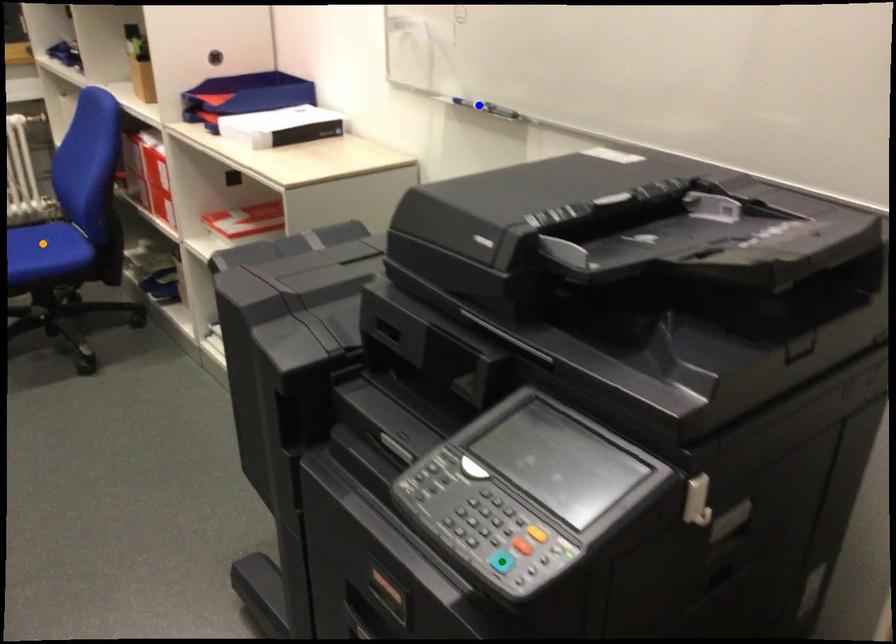
Order these from nearest to farthest:
green point
orange point
blue point

green point < blue point < orange point